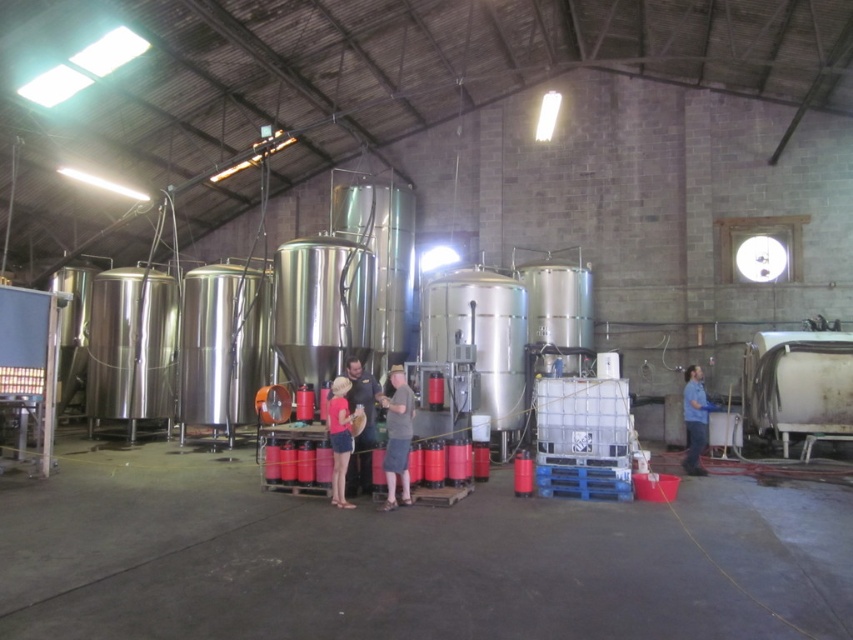
Question: Which of the following is the closest to the observer?

Choices:
 (A) matte red shirt at center
 (B) blue fabric shirt at right
 (C) matte black shirt at center
 (D) gray cotton t-shirt at center

Answer: (D)

Question: Which of the following is the closest to the observer?

Choices:
 (A) blue fabric shirt at right
 (B) gray cotton t-shirt at center

Answer: (B)

Question: Which object is closer to the camera taking this photo?

Choices:
 (A) matte red shirt at center
 (B) gray cotton t-shirt at center
 (C) matte black shirt at center
 (D) blue fabric shirt at right

Answer: (B)

Question: Is gray cotton t-shirt at center below matte black shirt at center?

Choices:
 (A) no
 (B) yes

Answer: (B)

Question: Is gray cotton t-shirt at center to the left of matte red shirt at center from the viewer's perspective?

Choices:
 (A) no
 (B) yes

Answer: (A)

Question: In this image, where is matte red shirt at center located relative to blue fabric shirt at right?

Choices:
 (A) above
 (B) below

Answer: (A)